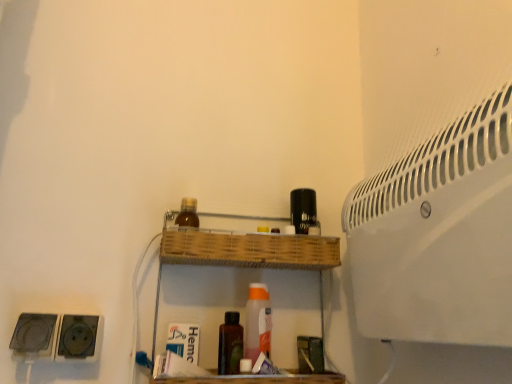
Question: Which direction should I rotate to face brown matte bottle at center, which ranks as the 2th bottle in left-to-right order, — up or down?

Choices:
 (A) down
 (B) up

Answer: (A)

Question: From the image's perspective, is brown glass bottle at upper center, the first bottle viewed from the top, under wooden at center?

Choices:
 (A) yes
 (B) no

Answer: (B)

Question: From the image's perspective, is brown glass bottle at upper center, arranged as the first bottle when viewed from the left, on wooden at center?

Choices:
 (A) no
 (B) yes

Answer: (B)

Question: From a real-world perspective, is brown glass bottle at upper center, which is counted as the second bottle, starting from the bottom, below wooden at center?

Choices:
 (A) no
 (B) yes

Answer: (A)

Question: Does brown glass bottle at upper center, arranged as the first bottle when viewed from the left, have a greater height compared to wooden at center?

Choices:
 (A) no
 (B) yes

Answer: (A)

Question: Does brown glass bottle at upper center, arranged as the first bottle when viewed from the left, have a larger size compared to wooden at center?

Choices:
 (A) no
 (B) yes

Answer: (A)

Question: Can you see brown glass bottle at upper center, which ranks as the 2th bottle in right-to-left order, touching wooden at center?

Choices:
 (A) yes
 (B) no

Answer: (B)

Question: Can you confirm if wooden at center is bigger than brown glass bottle at upper center, which ranks as the 2th bottle in right-to-left order?

Choices:
 (A) no
 (B) yes

Answer: (B)

Question: Does wooden at center have a lesser height compared to brown glass bottle at upper center, the first bottle viewed from the top?

Choices:
 (A) no
 (B) yes

Answer: (A)

Question: From a real-world perspective, is wooden at center located higher than brown glass bottle at upper center, arranged as the first bottle when viewed from the left?

Choices:
 (A) yes
 (B) no

Answer: (B)

Question: Is wooden at center oriented towards brown glass bottle at upper center, which ranks as the 2th bottle in right-to-left order?

Choices:
 (A) yes
 (B) no

Answer: (B)

Question: Are wooden at center and brown glass bottle at upper center, arranged as the first bottle when viewed from the left, making contact?

Choices:
 (A) yes
 (B) no

Answer: (B)

Question: Is wooden at center not inside brown glass bottle at upper center, the first bottle viewed from the top?

Choices:
 (A) no
 (B) yes

Answer: (B)

Question: Is brown matte bottle at center, arranged as the 1th bottle when viewed from the right, surrounded by wooden at center?

Choices:
 (A) yes
 (B) no

Answer: (A)